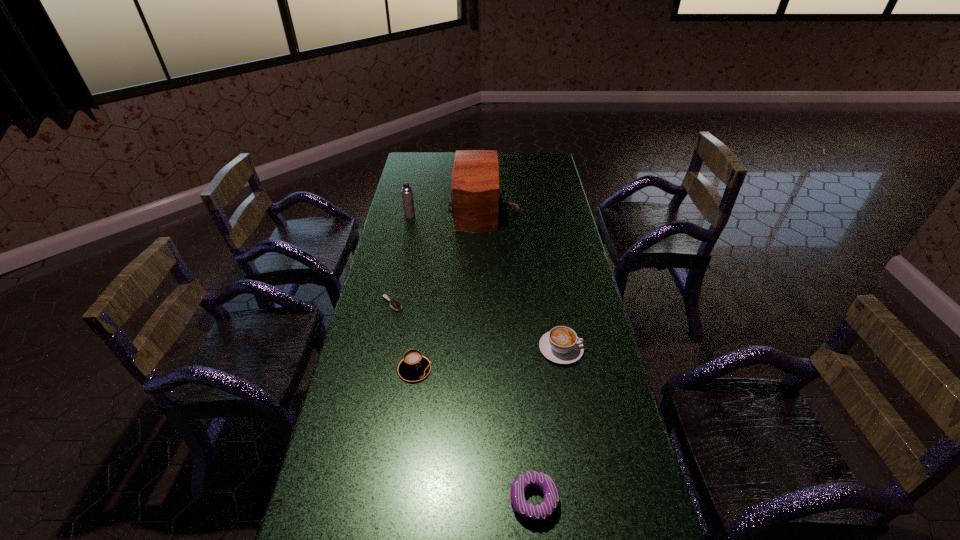
The height and width of the screenshot is (540, 960). I want to click on free space at the far edge of the desktop, so click(501, 156).

At what (x,y) coordinates should I click in order to perform the action: click on free region at the left edge. Please return your answer as a coordinate pair (x, y). Image resolution: width=960 pixels, height=540 pixels. Looking at the image, I should click on (381, 262).

Where is `free space at the right edge of the desktop`? This screenshot has width=960, height=540. free space at the right edge of the desktop is located at coordinates (588, 329).

Locate an element on the screen. This screenshot has width=960, height=540. blank space at the far left corner is located at coordinates (425, 168).

Locate an element on the screen. vacant space that's between the left cappuccino and the shortest object is located at coordinates (403, 336).

At what (x,y) coordinates should I click in order to perform the action: click on empty location between the rightmost object and the second shortest object. Please return your answer as a coordinate pair (x, y). This screenshot has width=960, height=540. Looking at the image, I should click on (547, 424).

You are a GUI agent. You are given a task and a screenshot of the screen. Output one action in this format:
    pyautogui.click(x=<x>, y=<y>)
    Task: Click on the empty space that is in between the second shortest object and the radio receiver
    This screenshot has height=540, width=960.
    Given the screenshot: What is the action you would take?
    pyautogui.click(x=509, y=354)

Locate an element on the screen. This screenshot has height=540, width=960. free point between the right cappuccino and the fourth object from right to left is located at coordinates (488, 359).

You are a GUI agent. You are given a task and a screenshot of the screen. Output one action in this format:
    pyautogui.click(x=<x>, y=<y>)
    Task: Click on the unoccupied area between the rightmost object and the tallest object
    
    Given the screenshot: What is the action you would take?
    pyautogui.click(x=522, y=279)

The height and width of the screenshot is (540, 960). Find the location of `vacant space in between the third farthest object and the doughnut`. vacant space in between the third farthest object and the doughnut is located at coordinates (463, 402).